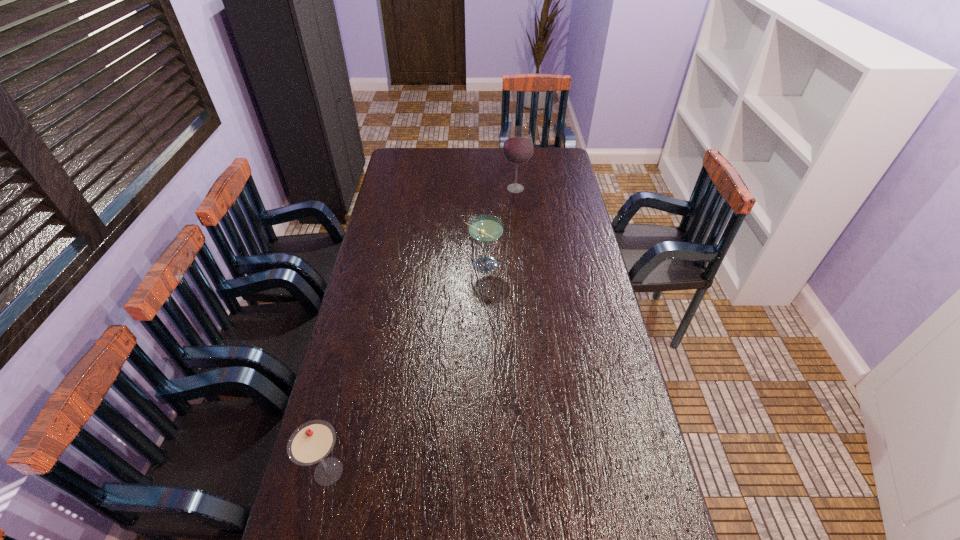
What are the coordinates of `the tallest object` in the screenshot? It's located at (518, 147).

I want to click on the rightmost object, so tap(518, 147).

I want to click on the second nearest object, so click(x=485, y=229).

Identify the location of the right martini. The image size is (960, 540). (485, 229).

You are a GUI agent. You are given a task and a screenshot of the screen. Output one action in this format:
    pyautogui.click(x=<x>, y=<y>)
    Task: Click on the nearest object
    The width and height of the screenshot is (960, 540).
    Given the screenshot: What is the action you would take?
    pyautogui.click(x=311, y=442)

This screenshot has height=540, width=960. I want to click on the left martini, so click(311, 442).

The width and height of the screenshot is (960, 540). I want to click on vacant region located 0.200m on the right of the tallest object, so click(x=572, y=188).

Where is `free location located on the back of the second object from left to right`? free location located on the back of the second object from left to right is located at coordinates (483, 217).

Where is `free space located 0.110m on the right of the nearest object`? The height and width of the screenshot is (540, 960). free space located 0.110m on the right of the nearest object is located at coordinates (392, 471).

Where is `object located in the left edge section of the desktop`? The image size is (960, 540). object located in the left edge section of the desktop is located at coordinates (311, 442).